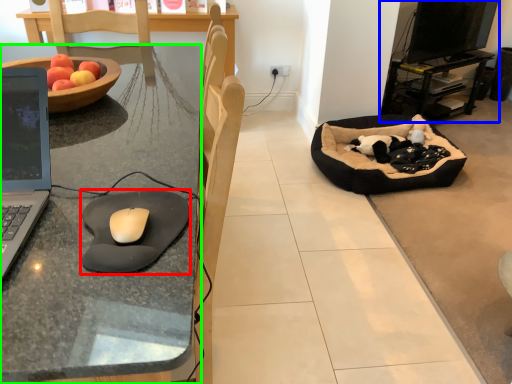
Question: Considering the real-world distances, which object is farthest from mousepad (highlighted by a red box)? entertainment center (highlighted by a blue box) or desk (highlighted by a green box)?

Choices:
 (A) entertainment center
 (B) desk

Answer: (A)